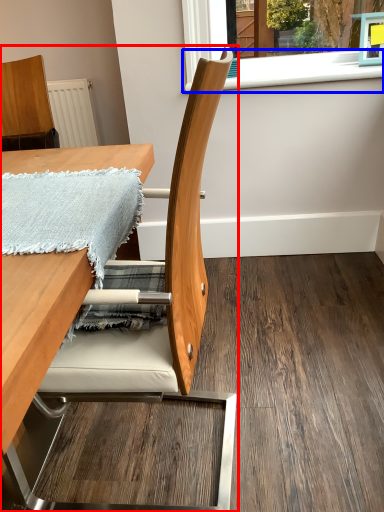
Question: Which object appears farthest to the camera in this image, chair (highlighted by a red box) or window sill (highlighted by a blue box)?

Choices:
 (A) chair
 (B) window sill

Answer: (B)